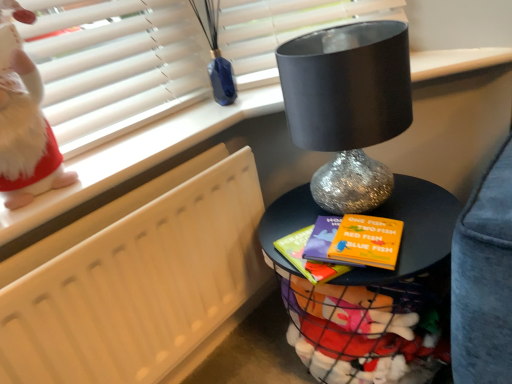
You are a GUI agent. You are given a task and a screenshot of the screen. Output one action in this format:
    pyautogui.click(x=<x>, y=<y>)
    Task: Click on the free point behind white fluffy doll at upper left
    The height and width of the screenshot is (384, 512).
    Given the screenshot: What is the action you would take?
    pyautogui.click(x=106, y=145)